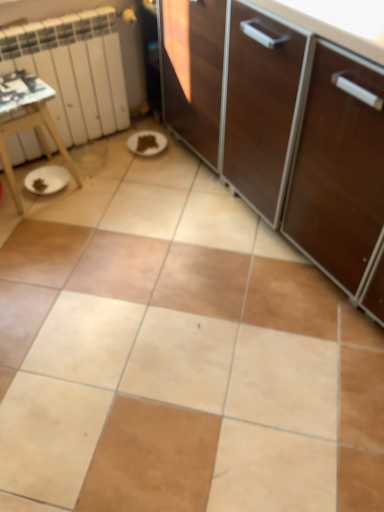
At what (x,y) coordinates should I click in order to perform the action: click on white wooden table at left. Please return your answer as a coordinate pair (x, y). The width and height of the screenshot is (384, 512). Looking at the image, I should click on (27, 119).

What is the approximate width of white wooden table at left?

white wooden table at left is 12.55 inches in width.

What is the approximate height of white wooden table at left?

The height of white wooden table at left is 18.51 inches.

Describe the element at coordinates (27, 119) in the screenshot. I see `white wooden table at left` at that location.

The width and height of the screenshot is (384, 512). What do you see at coordinates (74, 70) in the screenshot? I see `white matte radiator at left` at bounding box center [74, 70].

Find the location of a particular element. Image resolution: width=384 pixels, height=512 pixels. white matte radiator at left is located at coordinates (74, 70).

Identify the location of white wooden table at left. The height and width of the screenshot is (512, 384). (27, 119).

Is white matte radiator at left to the left of white wooden table at left from the viewer's perspective?

In fact, white matte radiator at left is to the right of white wooden table at left.

Does white matte radiator at left come behind white wooden table at left?

Yes.

Is point (32, 61) farther from camera compared to point (28, 95)?

Yes, point (32, 61) is behind point (28, 95).

From the image's perspective, is white matte radiator at left beneath white wooden table at left?

No, from the image's perspective, white matte radiator at left is not beneath white wooden table at left.

From a real-world perspective, which object stands above the other?

white matte radiator at left, from a real-world perspective.

Considering the sizes of objects white matte radiator at left and white wooden table at left in the image provided, who is wider, white matte radiator at left or white wooden table at left?

With larger width is white wooden table at left.

Based on the photo, considering the relative sizes of white matte radiator at left and white wooden table at left in the image provided, is white matte radiator at left shorter than white wooden table at left?

No.

Between white matte radiator at left and white wooden table at left, which one has smaller size?

white wooden table at left.

Is white matte radiator at left inside the boundaries of white wooden table at left, or outside?

white matte radiator at left lies outside white wooden table at left.

Is white matte radiator at left directly adjacent to white wooden table at left?

white matte radiator at left and white wooden table at left are not in contact.

Is white matte radiator at left positioned with its back to white wooden table at left?

No, white matte radiator at left is not facing away from white wooden table at left.

Measure the distance between white matte radiator at left and white wooden table at left.

They are 7.73 inches apart.

At what (x,y) coordinates should I click in order to perform the action: click on table that is below the white matte radiator at left (from the image's perspective). Please return your answer as a coordinate pair (x, y). The height and width of the screenshot is (512, 384). Looking at the image, I should click on (27, 119).

Can you confirm if white wooden table at left is positioned to the right of white matte radiator at left?

No.

Who is more distant, white wooden table at left or white matte radiator at left?

Positioned behind is white matte radiator at left.

Is point (3, 127) farther from viewer compared to point (12, 69)?

That is False.

From the image's perspective, relative to white matte radiator at left, is white wooden table at left above or below?

Clearly, from the image's perspective, white wooden table at left is below white matte radiator at left.

From a real-world perspective, is white wooden table at left located higher than white matte radiator at left?

Actually, white wooden table at left is physically below white matte radiator at left in the real world.

Does white wooden table at left have a greater width compared to white matte radiator at left?

Indeed, white wooden table at left has a greater width compared to white matte radiator at left.

Which of these two, white wooden table at left or white matte radiator at left, stands taller?

white matte radiator at left is taller.

Can you confirm if white wooden table at left is bigger than white matte radiator at left?

No.

Is white matte radiator at left located within white wooden table at left?

No, white matte radiator at left is located outside of white wooden table at left.

Would you consider white wooden table at left to be distant from white matte radiator at left?

white wooden table at left is near white matte radiator at left, not far away.

Is white wooden table at left looking in the opposite direction of white matte radiator at left?

Yes.

How many degrees apart are the facing directions of white wooden table at left and white matte radiator at left?

4.69 degrees.

This screenshot has height=512, width=384. In order to click on radiator behind the white wooden table at left in this screenshot , I will do `click(74, 70)`.

You are a GUI agent. You are given a task and a screenshot of the screen. Output one action in this format:
    pyautogui.click(x=<x>, y=<y>)
    Task: Click on the table on the left side of white matte radiator at left
    This screenshot has width=384, height=512.
    Given the screenshot: What is the action you would take?
    pyautogui.click(x=27, y=119)

You are a GUI agent. You are given a task and a screenshot of the screen. Output one action in this format:
    pyautogui.click(x=<x>, y=<y>)
    Task: Click on the radiator located above the white wooden table at left (from a real-world perspective)
    
    Given the screenshot: What is the action you would take?
    pyautogui.click(x=74, y=70)